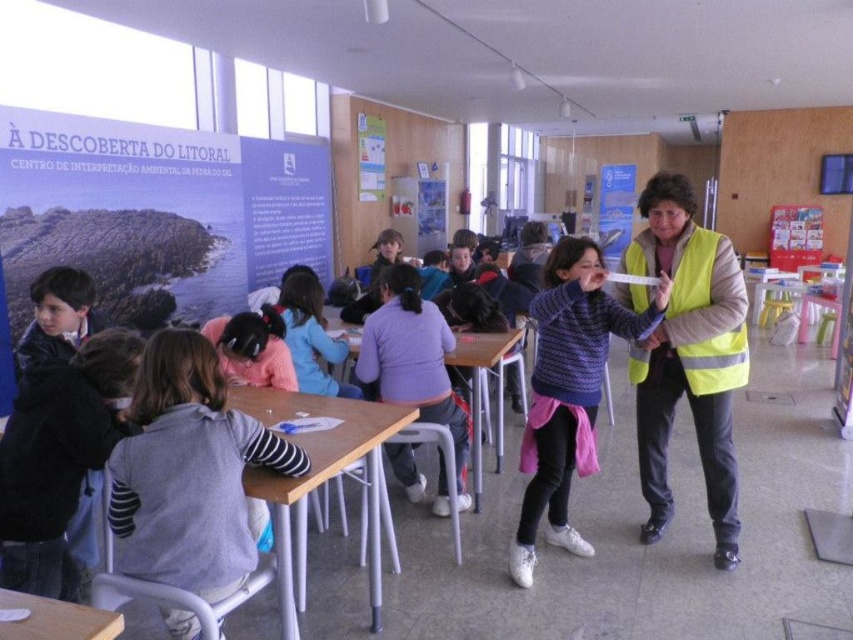
Question: Which point appears closest to the camera in this image?

Choices:
 (A) (86, 330)
 (B) (132, 518)

Answer: (B)

Question: In this image, where is gray sweater at left located relative to wooden table at center?

Choices:
 (A) above
 (B) below

Answer: (A)

Question: Does yellow reflective vest at center have a greater width compared to wooden table at lower left?

Choices:
 (A) yes
 (B) no

Answer: (A)

Question: Estimate the real-world distances between objects in this image. Which object is closer to the white plastic table at center?

Choices:
 (A) gray sweater at left
 (B) dark gray sweater at left

Answer: (A)

Question: Which object is the closest to the knitted sweater at center?

Choices:
 (A) gray sweater at left
 (B) dark gray sweater at left

Answer: (A)

Question: Is knitted sweater at center positioned before white plastic table at center?

Choices:
 (A) yes
 (B) no

Answer: (B)